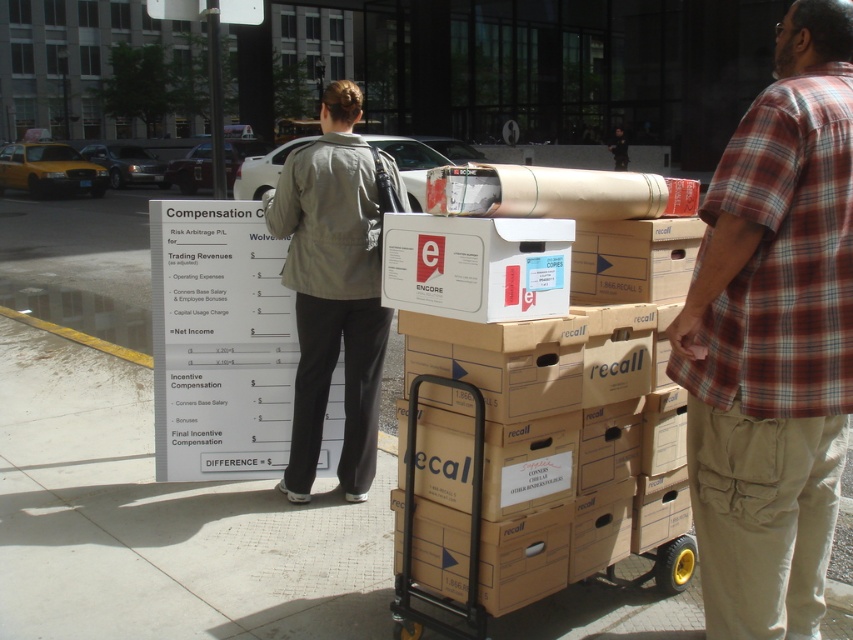
You are a city planner observing the scene and need to determine if the plaid shirt at center and the light gray jacket at center can both fit through a 1.2 meter wide pedestrian gate. Which one is wider?

The plaid shirt at center is wider than the light gray jacket at center, but without specific measurements, we can only confirm that the plaid shirt at center is wider. The gate width is 1.2 meters, but we cannot determine if both will fit without knowing their exact widths.

What is the position of the plaid shirt at center in the image?

The plaid shirt at center is located at point (773, 339).